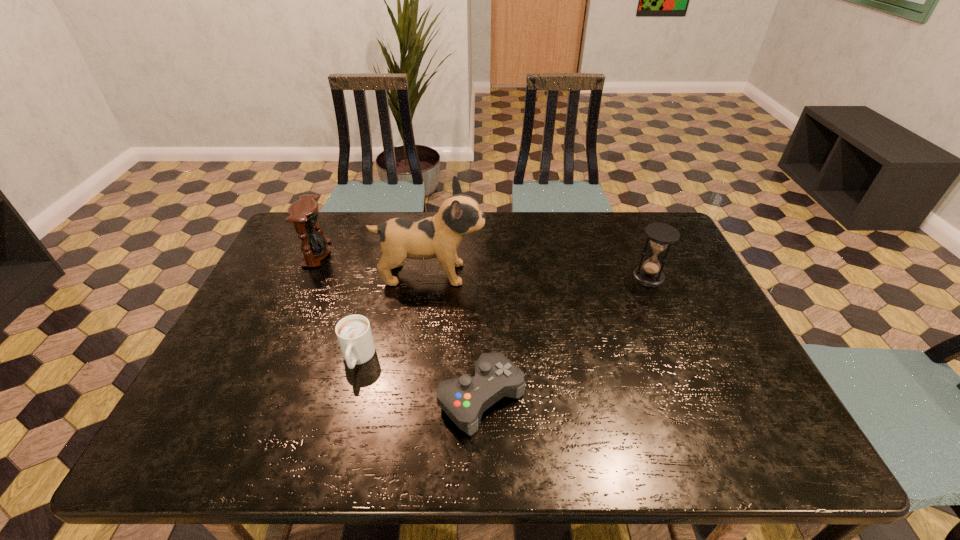
The height and width of the screenshot is (540, 960). I want to click on free point between the shortest object and the left hourglass, so click(x=399, y=326).

Locate an element on the screen. Image resolution: width=960 pixels, height=540 pixels. empty space between the left hourglass and the rightmost object is located at coordinates (483, 265).

Where is `free space between the rightmost object and the tallest object`? Image resolution: width=960 pixels, height=540 pixels. free space between the rightmost object and the tallest object is located at coordinates (540, 275).

Locate an element on the screen. The height and width of the screenshot is (540, 960). vacant region between the left hourglass and the rightmost object is located at coordinates (483, 265).

Identify the location of vacant space that's between the puppy and the rightmost object. Image resolution: width=960 pixels, height=540 pixels. (540, 275).

Find the location of a particular element. This screenshot has width=960, height=540. free space between the tallest object and the fourth tallest object is located at coordinates (394, 316).

Where is `vacant area that lies between the left hourglass and the control`? The width and height of the screenshot is (960, 540). vacant area that lies between the left hourglass and the control is located at coordinates [399, 326].

Identify the location of free space between the left hourglass and the tallest object. This screenshot has height=540, width=960. (373, 264).

The image size is (960, 540). What are the coordinates of `free space between the tallest object and the left hourglass` in the screenshot? It's located at (373, 264).

You are a GUI agent. You are given a task and a screenshot of the screen. Output one action in this format:
    pyautogui.click(x=<x>, y=<y>)
    Task: Click on the vacant space in between the tallest object and the shortest object
    This screenshot has height=540, width=960.
    Given the screenshot: What is the action you would take?
    pyautogui.click(x=456, y=336)